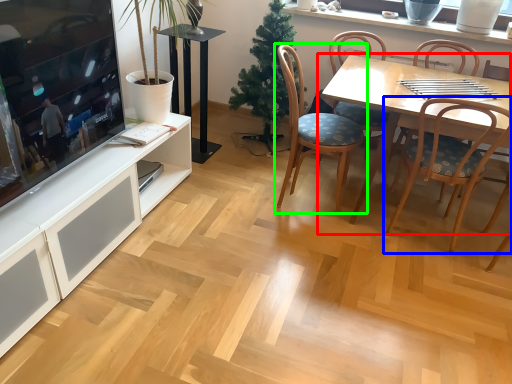
Question: Based on their relative distances, which object is nearer to kitchen & dining room table (highlighted by a red box)? Choose from chair (highlighted by a blue box) and chair (highlighted by a green box).

Choices:
 (A) chair
 (B) chair

Answer: (A)